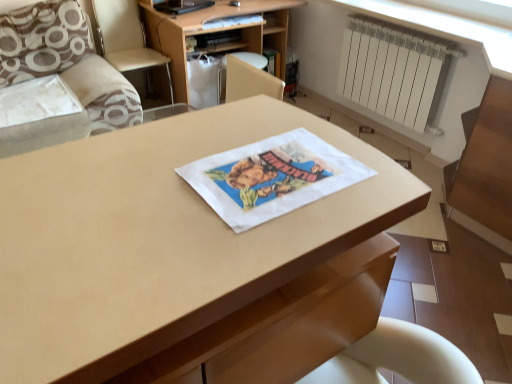
Question: Does brown textured pillow at upper left appear on the left side of white matte radiator at upper right?

Choices:
 (A) no
 (B) yes

Answer: (B)

Question: Is brown textured pillow at upper left not within white matte radiator at upper right?

Choices:
 (A) yes
 (B) no

Answer: (A)

Question: Does brown textured pillow at upper left have a lesser height compared to white matte radiator at upper right?

Choices:
 (A) yes
 (B) no

Answer: (A)

Question: Can you confirm if brown textured pillow at upper left is wider than white matte radiator at upper right?

Choices:
 (A) no
 (B) yes

Answer: (B)

Question: Is brown textured pillow at upper left surrounding white matte radiator at upper right?

Choices:
 (A) no
 (B) yes

Answer: (A)

Question: From a real-world perspective, relative to brown textured pillow at upper left, is wooden at upper center vertically above or below?

Choices:
 (A) above
 (B) below

Answer: (B)

Question: Looking at their shapes, would you say wooden at upper center is wider or thinner than brown textured pillow at upper left?

Choices:
 (A) wide
 (B) thin

Answer: (A)

Question: Considering their positions, is wooden at upper center located in front of or behind brown textured pillow at upper left?

Choices:
 (A) front
 (B) behind

Answer: (B)

Question: Would you say wooden at upper center is inside or outside brown textured pillow at upper left?

Choices:
 (A) outside
 (B) inside

Answer: (A)

Question: Relative to matte wood desk at center, is wooden at upper center in front or behind?

Choices:
 (A) behind
 (B) front

Answer: (A)

Question: From the image's perspective, is wooden at upper center located above or below matte wood desk at center?

Choices:
 (A) below
 (B) above

Answer: (B)

Question: From a real-world perspective, is wooden at upper center positioned above or below matte wood desk at center?

Choices:
 (A) below
 (B) above

Answer: (A)

Question: Is wooden at upper center taller or shorter than matte wood desk at center?

Choices:
 (A) tall
 (B) short

Answer: (B)

Question: In the image, is brown textured pillow at upper left positioned in front of or behind wooden at upper center?

Choices:
 (A) behind
 (B) front

Answer: (B)

Question: From a real-world perspective, is brown textured pillow at upper left above or below wooden at upper center?

Choices:
 (A) below
 (B) above

Answer: (B)